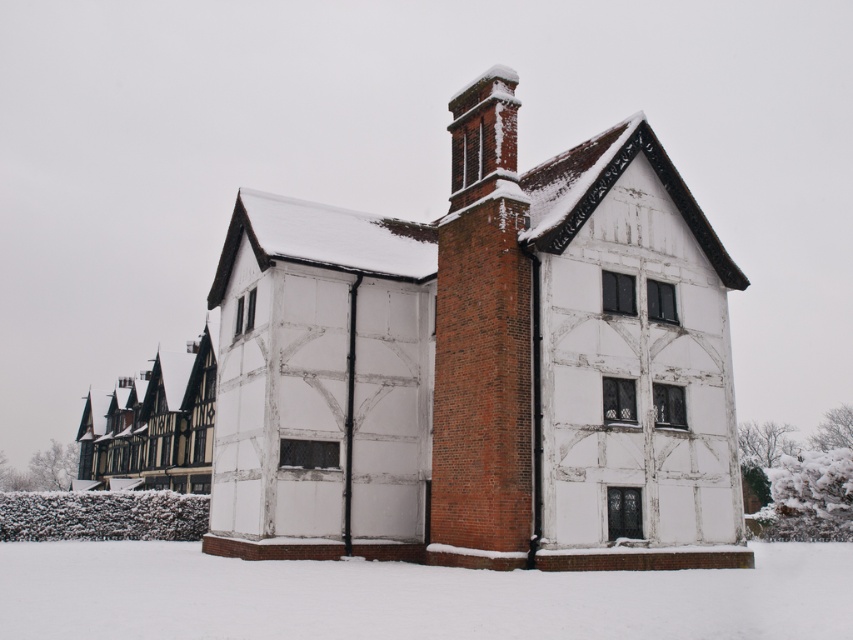
Question: Can you confirm if white powdery snow at lower center is thinner than red brick chimney at upper center?

Choices:
 (A) yes
 (B) no

Answer: (B)

Question: Can you confirm if white powdery snow at lower center is wider than red brick chimney at upper center?

Choices:
 (A) yes
 (B) no

Answer: (A)

Question: Is white powdery snow at lower center closer to camera compared to red brick chimney at upper center?

Choices:
 (A) no
 (B) yes

Answer: (B)

Question: Which point appears closest to the camera in this image?

Choices:
 (A) (308, 636)
 (B) (471, 147)

Answer: (A)